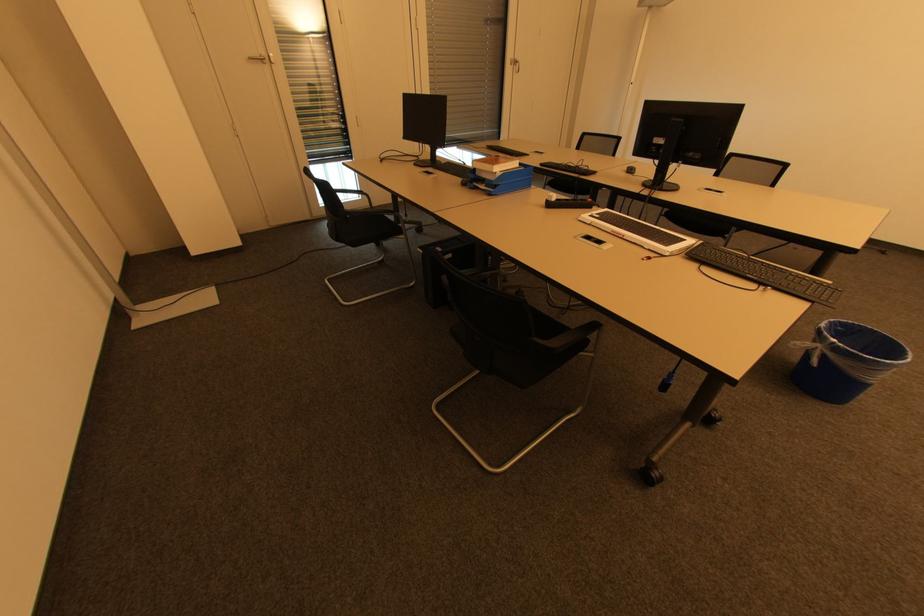
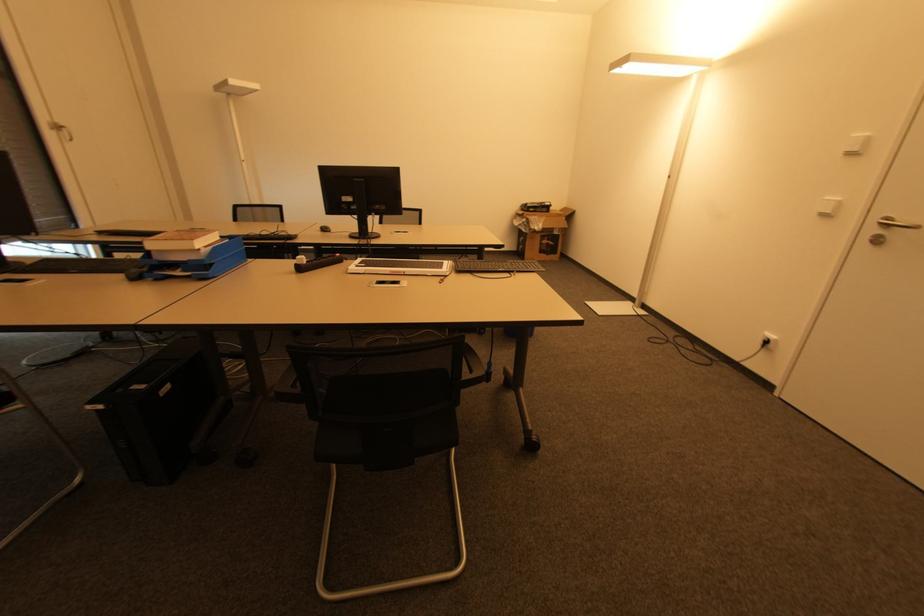
Locate, in the second image, the point that corresponds to pixel 423 252 in the first image.

(101, 408)